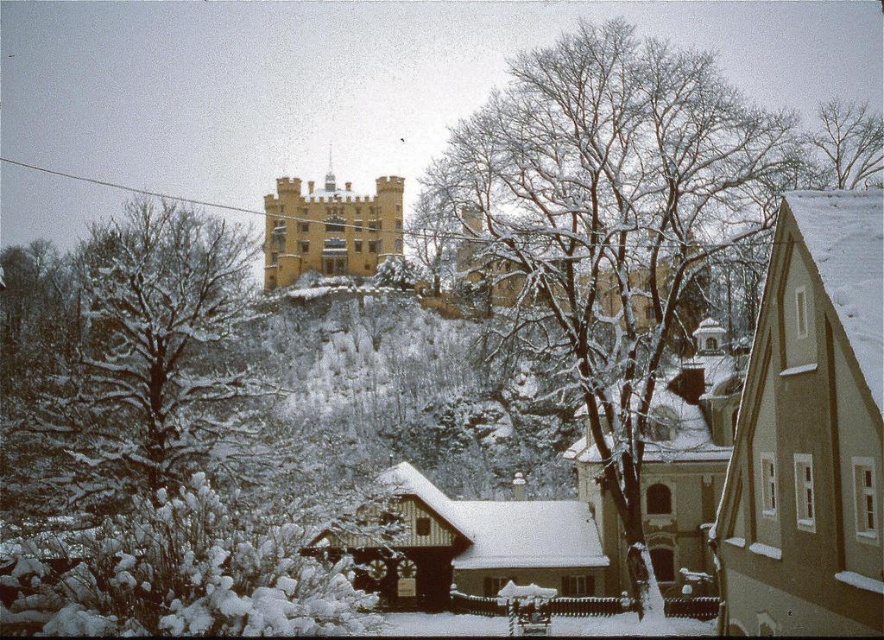
Which is above, snow-covered branches at center or snowy bare branches at upper center?

snowy bare branches at upper center is above.

Does snow-covered branches at center have a larger size compared to snowy bare branches at upper center?

Yes.

Does point (625, 140) lie behind point (814, 131)?

No, it is in front of (814, 131).

Where is `snow-covered branches at center`? This screenshot has height=640, width=884. snow-covered branches at center is located at coordinates (606, 225).